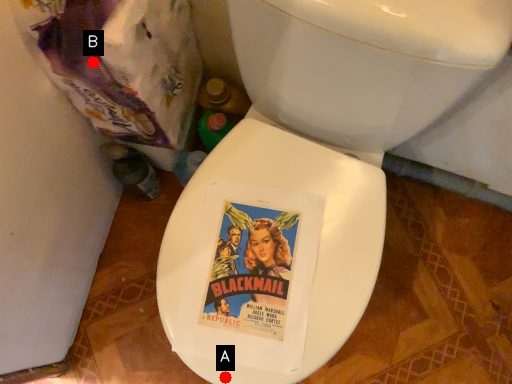
Question: Two points are circled on the image, labeled by A and B beside each circle. Which point is closer to the camera taking this photo?

Choices:
 (A) A is closer
 (B) B is closer

Answer: (B)